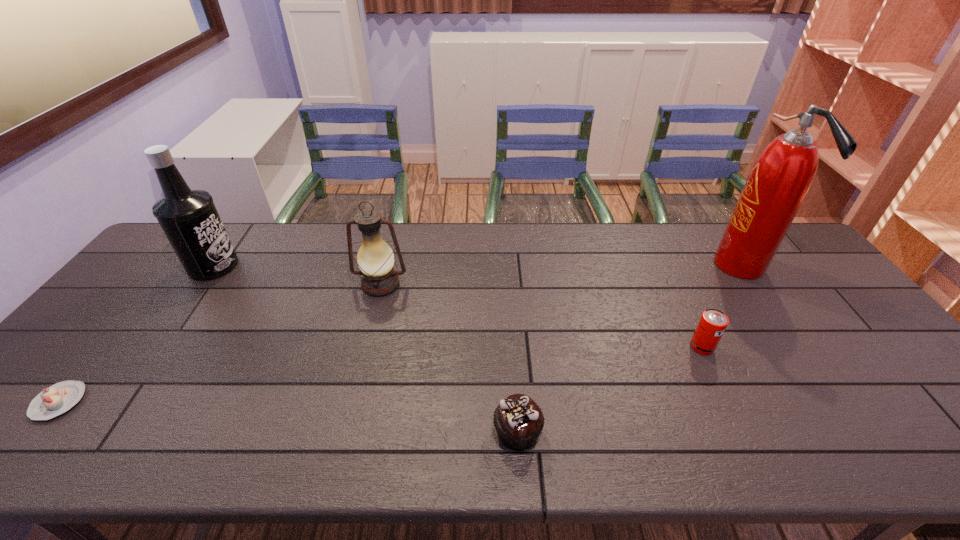
Locate which object ranks fourth in proximity to the left cupcake. Please provide its 2D coordinates. Your answer should be formatted as a tuple, i.e. [(x, y)], where the tuple contains the x and y coordinates of a point satisfying the conditions above.

[(712, 324)]

The width and height of the screenshot is (960, 540). In order to click on the second closest object to the can in this screenshot , I will do [x=518, y=420].

Find the location of a particular element. This screenshot has height=540, width=960. vacant position in the image that satisfies the following two spatial constraints: 1. on the front label of the right cupcake; 2. on the left side of the fifth shortest object is located at coordinates (94, 433).

Identify the location of vacant area in the image that satisfies the following two spatial constraints: 1. on the back side of the second object from right to left; 2. on the left side of the leftmost object. (105, 347).